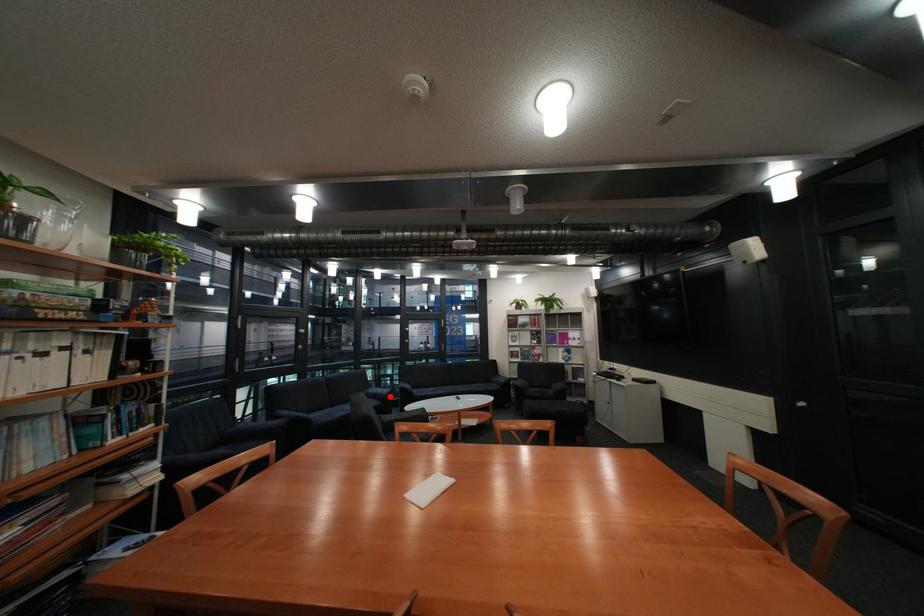
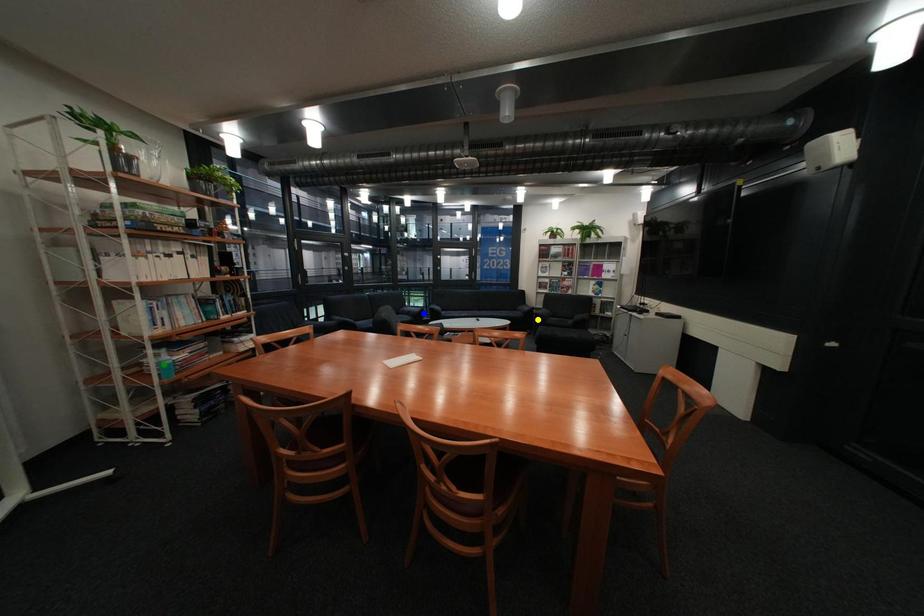
Question: I am providing you with two images of the same scene from different viewpoints. A red point is marked on the first image. You are given multiple points on the second image. Can you choose the point in image 2 that corresponds to the point in image 1?

Choices:
 (A) yellow point
 (B) blue point
 (C) green point

Answer: (B)